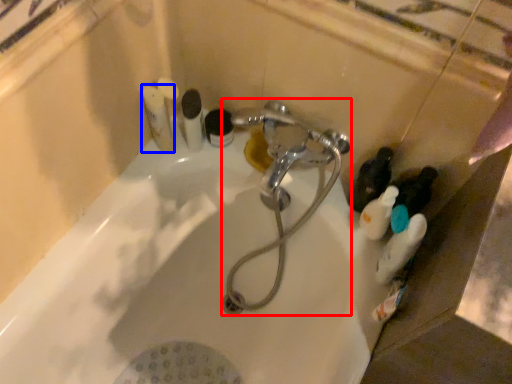
Question: Which object appears farthest to the camera in this image, plumbing fixture (highlighted by a red box) or toiletry (highlighted by a blue box)?

Choices:
 (A) plumbing fixture
 (B) toiletry

Answer: (B)